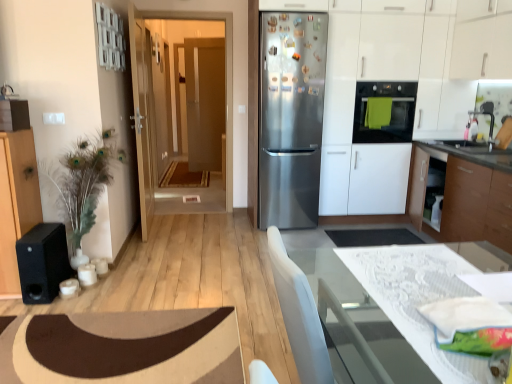
This screenshot has height=384, width=512. I want to click on empty space that is to the right of wooden door at center, placed as the 2th door when sorted from back to front, so click(185, 223).